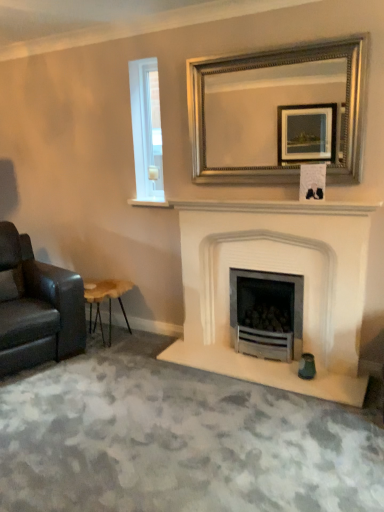
Identify the location of vacant space situated above silver/golden metallic mirror at upper center (from a real-world perspective). The width and height of the screenshot is (384, 512). (270, 49).